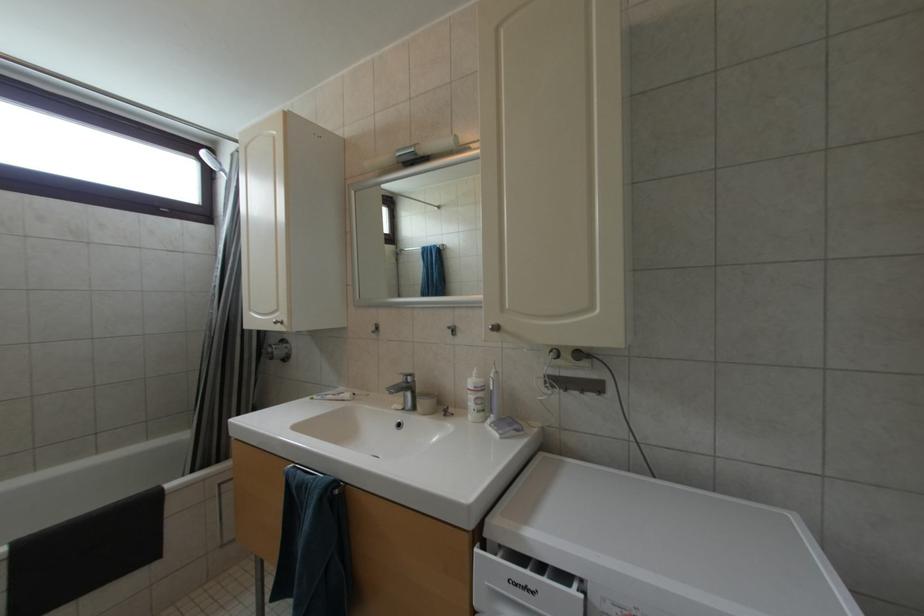
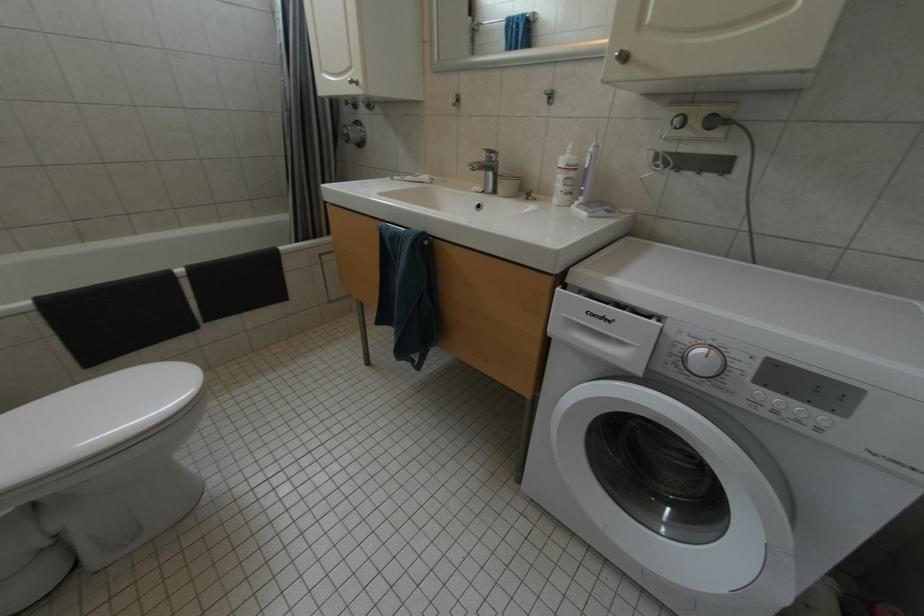
Question: The images are taken continuously from a first-person perspective. In which direction are you moving?

Choices:
 (A) Left
 (B) Right
 (C) Forward
 (D) Backward

Answer: (A)